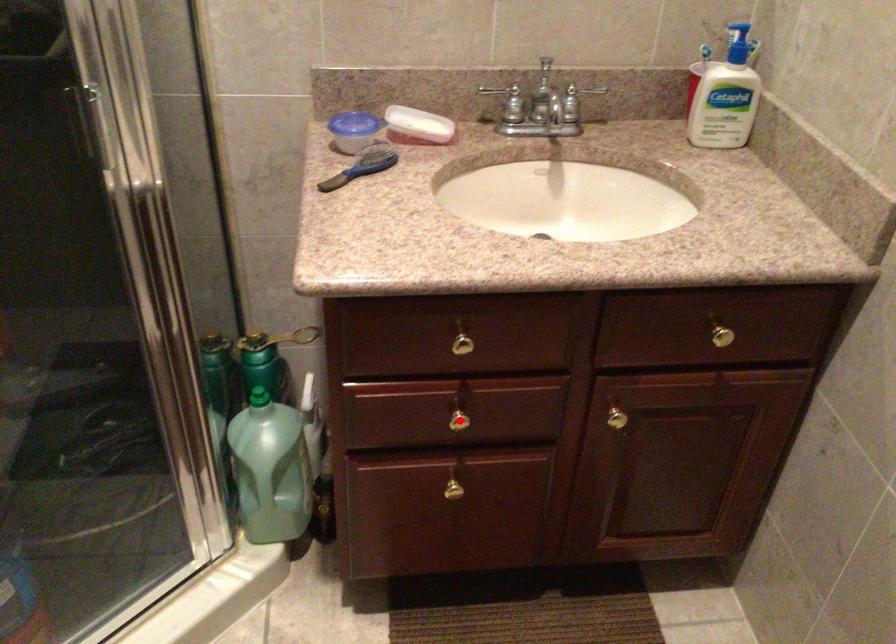
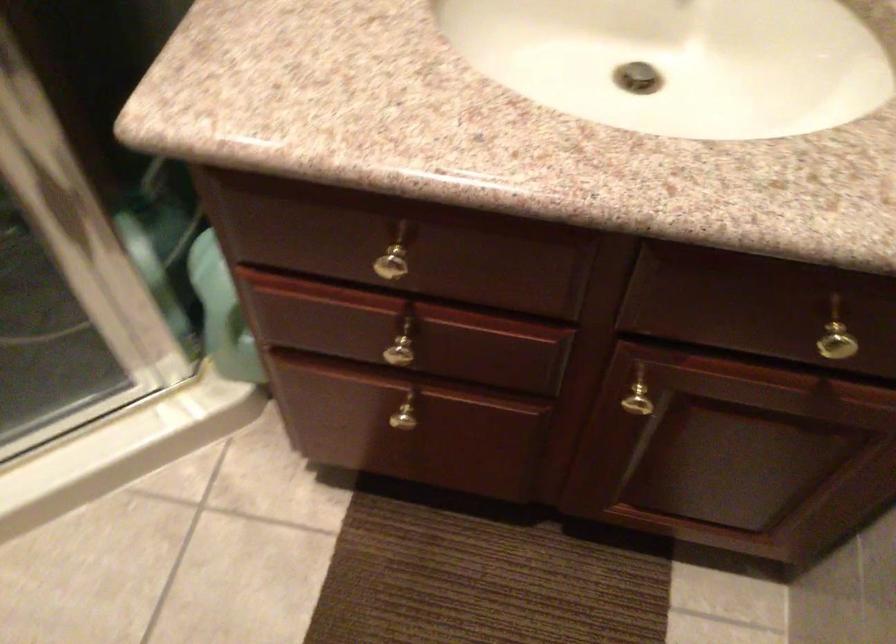
Question: I am providing you with two images of the same scene from different viewpoints. Image1 has a red point marked. In image2, the corresponding 3D location appears at what relative position? Reply with the corresponding letter.

Choices:
 (A) Closer
 (B) Farther

Answer: (A)